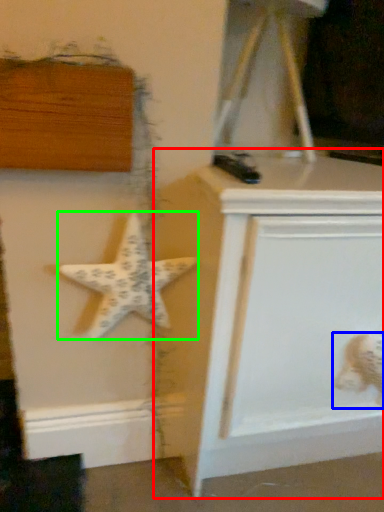
Question: Which is farther away from vanity (highlighted by a red box)? toy (highlighted by a blue box) or starfish (highlighted by a green box)?

Choices:
 (A) toy
 (B) starfish

Answer: (A)